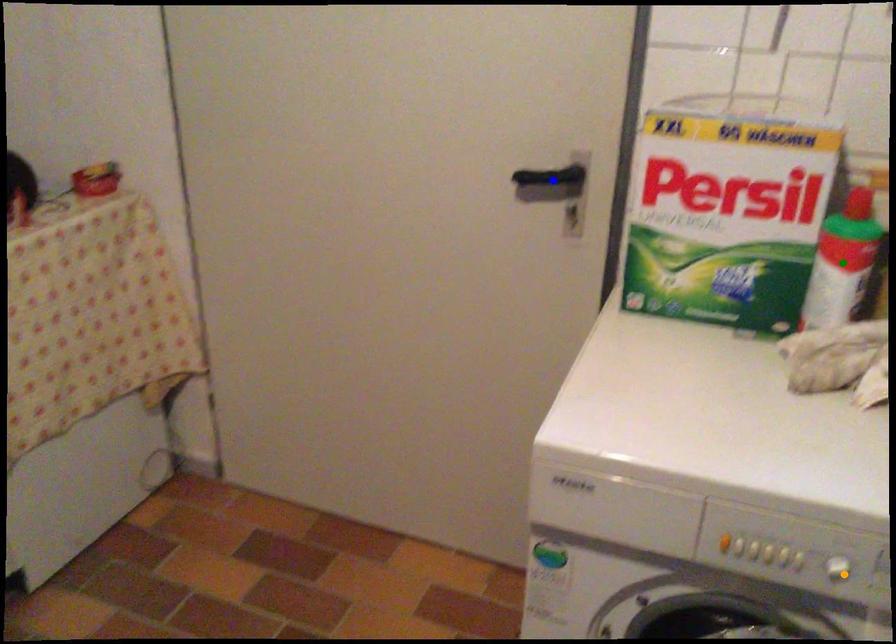
Consider the image. Order these from farthest to nearest:
- orange point
- blue point
- green point

blue point < green point < orange point